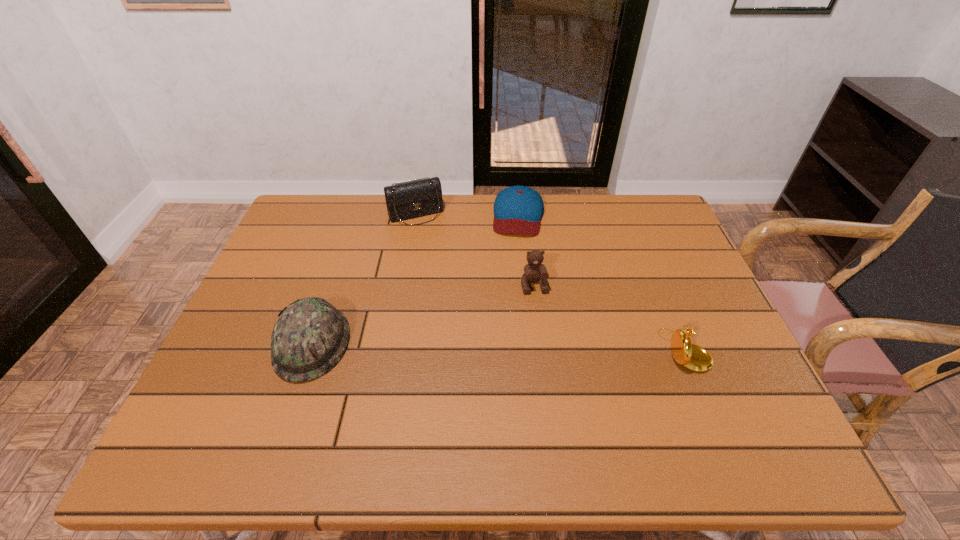
The width and height of the screenshot is (960, 540). What are the coordinates of `free space between the headwear and the third farthest object` in the screenshot? It's located at (423, 315).

In order to click on free spot between the leftmost object and the third farthest object in this screenshot , I will do `click(423, 315)`.

Find the location of a particular element. The height and width of the screenshot is (540, 960). empty space that is in between the second object from left to right and the rightmost object is located at coordinates (550, 282).

I want to click on free area in between the rightmost object and the clutch bag, so click(550, 282).

The image size is (960, 540). I want to click on vacant space in between the baseball cap and the headwear, so click(x=416, y=280).

This screenshot has width=960, height=540. In order to click on unoccupied area between the second object from left to right and the headwear in this screenshot , I will do `click(364, 280)`.

Where is `free spot between the pocket watch and the clutch bag`? The image size is (960, 540). free spot between the pocket watch and the clutch bag is located at coordinates (550, 282).

Image resolution: width=960 pixels, height=540 pixels. In order to click on vacant space in between the rightmost object and the clutch bag in this screenshot , I will do `click(550, 282)`.

Identify which object is the closest to the leftmost object. Please provide its 2D coordinates. Your answer should be formatted as a tuple, i.e. [(x, y)], where the tuple contains the x and y coordinates of a point satisfying the conditions above.

[(412, 199)]

You are a GUI agent. You are given a task and a screenshot of the screen. Output one action in this format:
    pyautogui.click(x=<x>, y=<y>)
    Task: Click on the third closest object to the pocket watch
    The height and width of the screenshot is (540, 960).
    Given the screenshot: What is the action you would take?
    pyautogui.click(x=412, y=199)